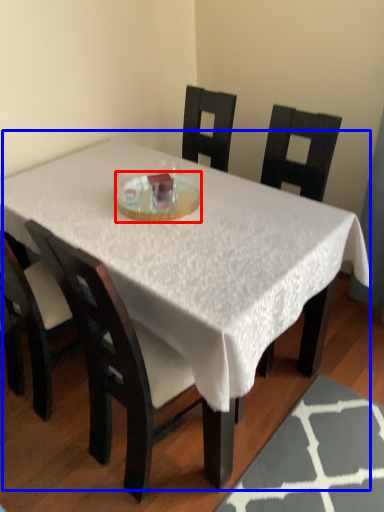
Question: Which object appears farthest to the camera in this image, glass plate (highlighted by a red box) or table (highlighted by a blue box)?

Choices:
 (A) glass plate
 (B) table

Answer: (A)